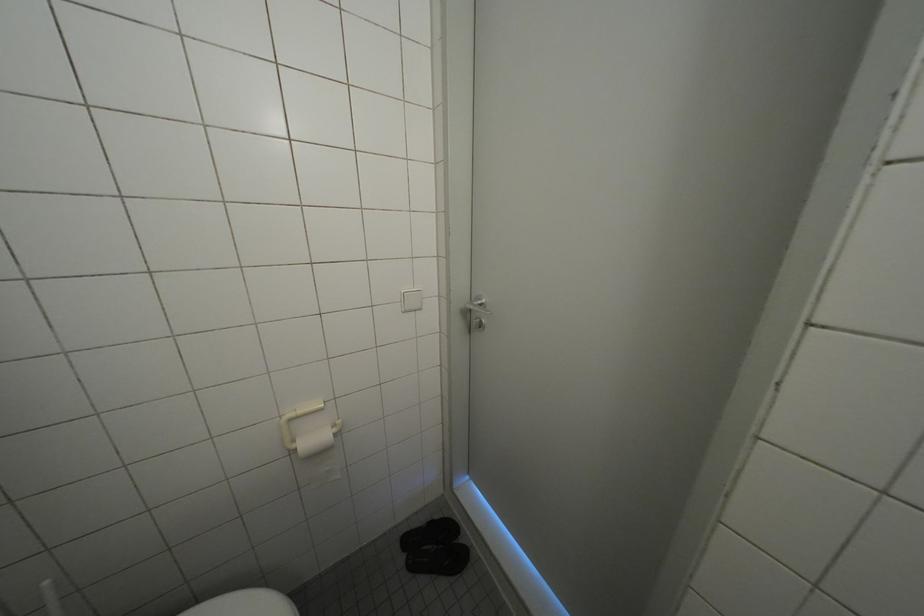
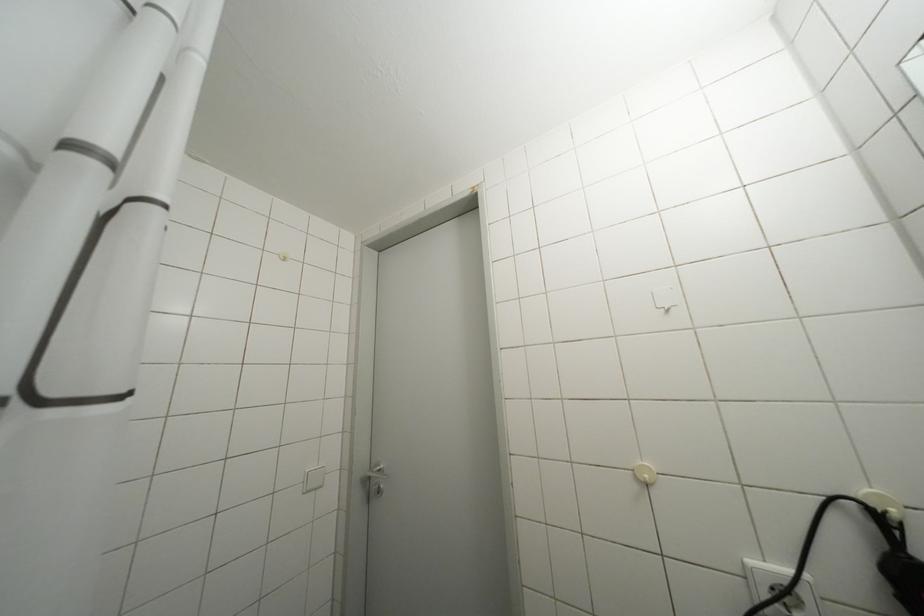
Based on the continuous images, in which direction is the camera rotating?

The camera rotated toward right-up.